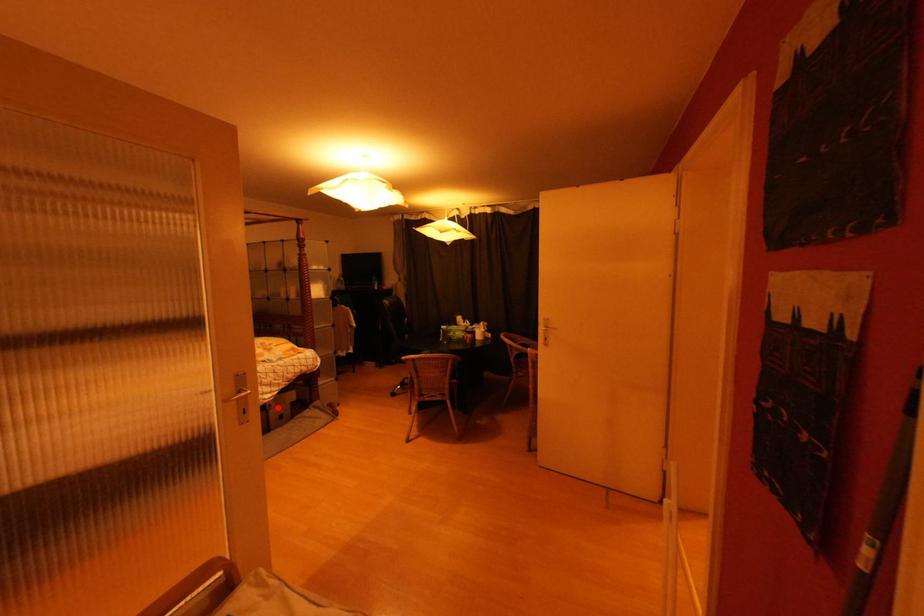
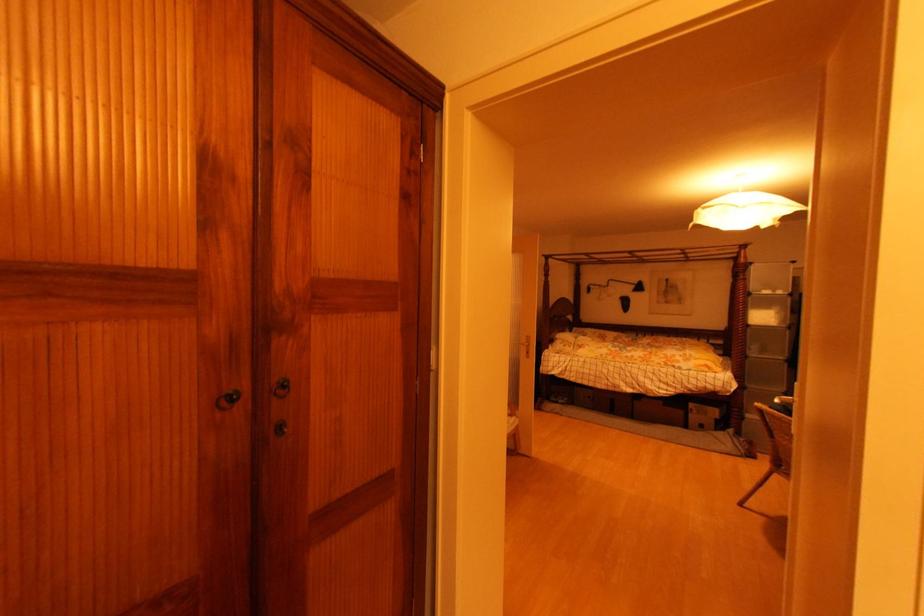
Question: I am providing you with two images of the same scene from different viewpoints. In image1, a red point is highlighted. Considering the same 3D point in image2, which of the following is correct?

Choices:
 (A) It is closer
 (B) It is farther

Answer: (B)